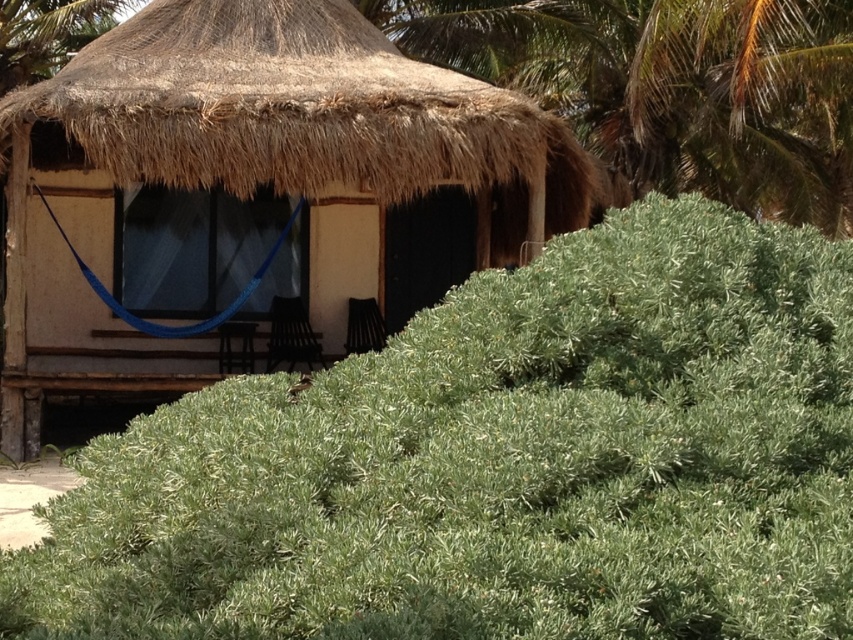
Does green leafy hedge at lower center have a larger size compared to brown thatch roof at upper center?

No, green leafy hedge at lower center is not bigger than brown thatch roof at upper center.

Is point (660, 568) behind point (316, 108)?

No, (660, 568) is in front of (316, 108).

Locate an element on the screen. green leafy hedge at lower center is located at coordinates (500, 464).

Which is below, thatched roof hut at center or brown thatch roof at upper center?

Positioned lower is thatched roof hut at center.

Between thatched roof hut at center and brown thatch roof at upper center, which one is positioned higher?

brown thatch roof at upper center is higher up.

Who is more forward, (440, 260) or (155, 172)?

Positioned in front is point (155, 172).

Where is `thatched roof hut at center`? thatched roof hut at center is located at coordinates (260, 177).

Which is behind, point (474, 156) or point (722, 131)?

The point (722, 131) is behind.

Is the position of thatched roof hut at center less distant than that of green leafy palm tree at upper right?

Yes, thatched roof hut at center is in front of green leafy palm tree at upper right.

At what (x,y) coordinates should I click in order to perform the action: click on thatched roof hut at center. Please return your answer as a coordinate pair (x, y). The height and width of the screenshot is (640, 853). Looking at the image, I should click on (260, 177).